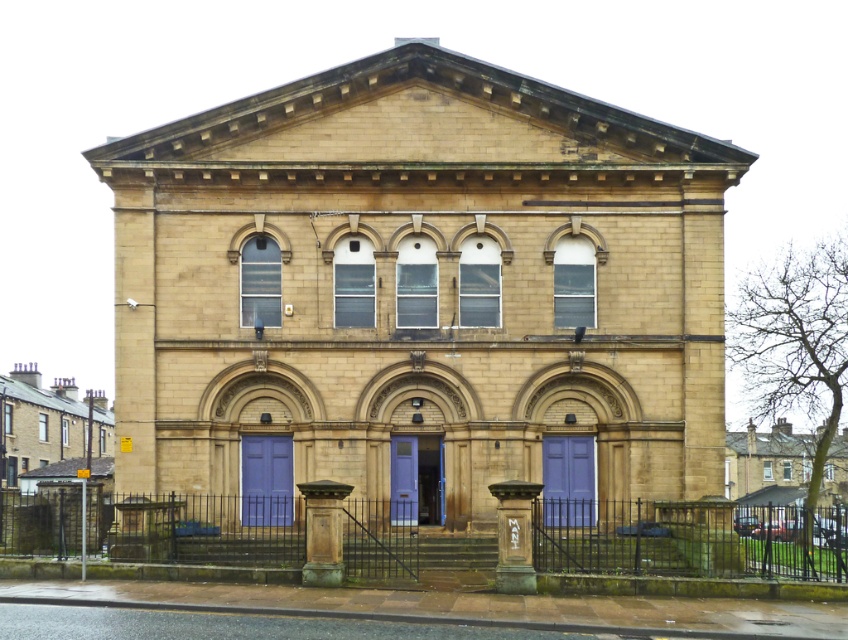
You are standing in front of the two story building and want to take a photo. You notice two points marked on the building at coordinates point (520, 493) and point (304, 577). Which point will appear closer to the bottom edge of your camera viewfinder when you aim at the center of the building?

Point (304, 577) will appear closer to the bottom edge of the camera viewfinder because it is closer to the camera than point (520, 493).

You are standing at the entrance of the building and need to reach the purple matte door at center. There is a bronze stone pillar at lower center blocking your path. Can you walk around it to reach the door?

The bronze stone pillar at lower center is 43.96 feet away from the purple matte door at center, so you can walk around the bronze stone pillar at lower center to reach the purple matte door at center since there is enough space between them.